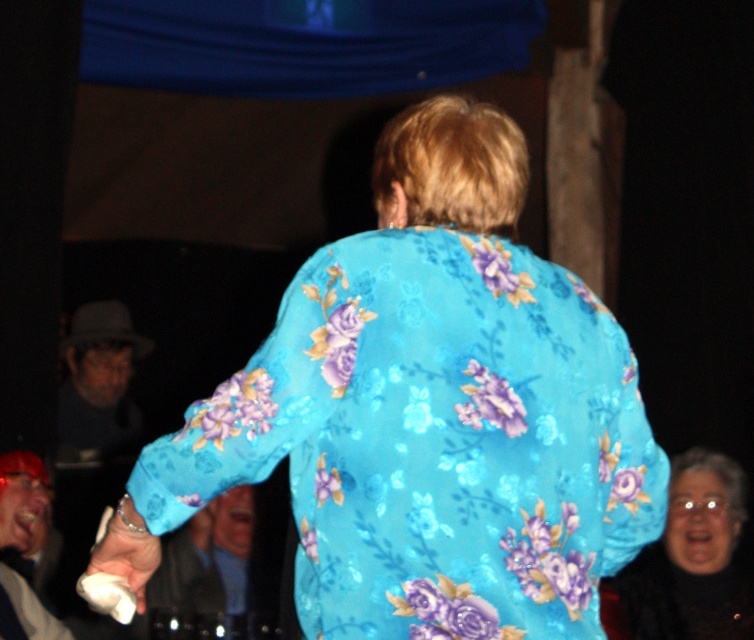
Is floral-patterned fabric at center taller than matte white phone at lower left?

Yes.

Does point (366, 328) come closer to viewer compared to point (5, 608)?

Yes.

Where is `floral-patterned fabric at center`? The width and height of the screenshot is (754, 640). floral-patterned fabric at center is located at coordinates (428, 413).

Can you confirm if floral-patterned fabric at lower right is positioned above matte white phone at lower left?

No, floral-patterned fabric at lower right is not above matte white phone at lower left.

Image resolution: width=754 pixels, height=640 pixels. Describe the element at coordinates (688, 561) in the screenshot. I see `floral-patterned fabric at lower right` at that location.

Does point (694, 627) come behind point (23, 509)?

No, (694, 627) is in front of (23, 509).

Locate an element on the screen. The height and width of the screenshot is (640, 754). floral-patterned fabric at lower right is located at coordinates (688, 561).

Is floral-patterned fabric at center further to the viewer compared to floral-patterned fabric at lower right?

No, floral-patterned fabric at center is in front of floral-patterned fabric at lower right.

Who is higher up, floral-patterned fabric at center or floral-patterned fabric at lower right?

floral-patterned fabric at center is above.

This screenshot has width=754, height=640. I want to click on floral-patterned fabric at center, so click(x=428, y=413).

You are a GUI agent. You are given a task and a screenshot of the screen. Output one action in this format:
    pyautogui.click(x=<x>, y=<y>)
    Task: Click on the floral-patterned fabric at center
    This screenshot has width=754, height=640.
    Given the screenshot: What is the action you would take?
    pyautogui.click(x=428, y=413)